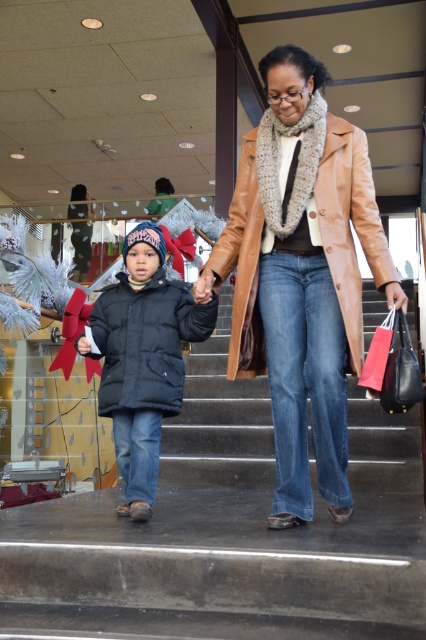
You are a security guard in the mall and need to identify the person wearing the leather coat at center. Based on the scene description, which direction should you look relative to the matte black jacket at center?

The leather coat at center is to the right of the matte black jacket at center, so you should look to the right of the matte black jacket at center to find the person wearing the leather coat at center.

You are a delivery person carrying a large box that is 5 feet wide. You need to walk down the smooth concrete stairs at center. Can you fit through the stairs without tilting the box sideways?

The smooth concrete stairs at center are 5.45 feet apart, which is wider than your 5 feet wide box. You can fit through the stairs without tilting the box sideways.

You are a delivery person carrying a large package wrapped in brown paper. You see the smooth concrete stairs at center and the leather coat at center. Can you determine if the package will fit through the stairs? Please explain your reasoning.

The smooth concrete stairs at center are wider than the leather coat at center. Since the package is wrapped in brown paper, its dimensions are not specified, but if it is similar in width to the leather coat, it should fit through the stairs. However, if the package is wider than the coat, it might not fit. The exact width of the package is needed to determine this.